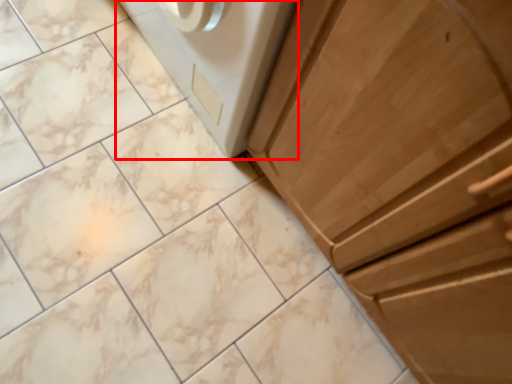
Question: In this image, where is home appliance (annotated by the red box) located relative to cabinetry?

Choices:
 (A) right
 (B) left

Answer: (B)